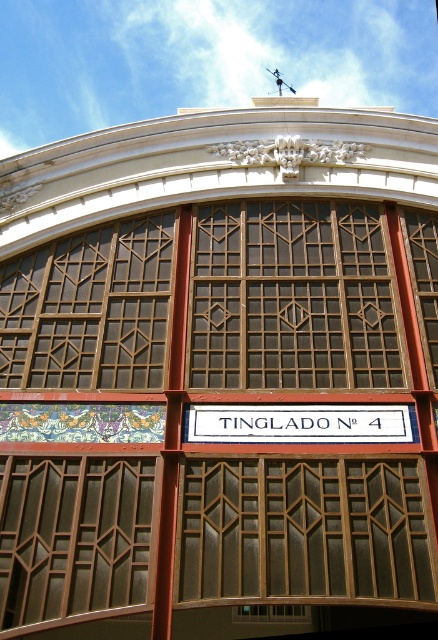
Question: Considering the relative positions of brown wooden window at left and white painted wood sign at center in the image provided, where is brown wooden window at left located with respect to white painted wood sign at center?

Choices:
 (A) left
 (B) right

Answer: (A)

Question: Among these points, which one is farthest from the camera?

Choices:
 (A) (398, 404)
 (B) (148, 496)
 (C) (240, 541)

Answer: (A)

Question: Does brown textured glass at center lie in front of white painted wood sign at center?

Choices:
 (A) no
 (B) yes

Answer: (B)

Question: Which is farther from the brown wooden window at left?

Choices:
 (A) white painted wood sign at center
 (B) brown textured glass at center

Answer: (A)

Question: Which object appears closest to the camera in this image?

Choices:
 (A) brown wooden window at left
 (B) brown textured glass at center
 (C) white painted wood sign at center

Answer: (A)

Question: Can you confirm if brown wooden window at left is positioned to the right of white painted wood sign at center?

Choices:
 (A) no
 (B) yes

Answer: (A)